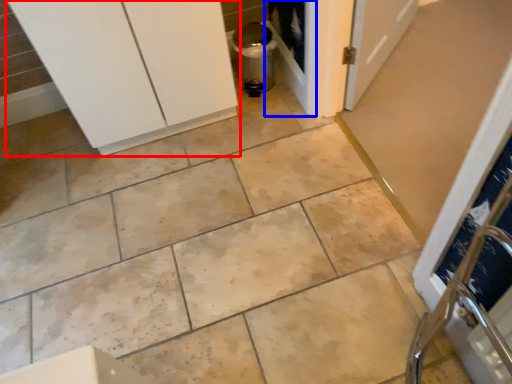
Question: Which object is further to the camera taking this photo, door (highlighted by a red box) or screen door (highlighted by a blue box)?

Choices:
 (A) door
 (B) screen door

Answer: (B)